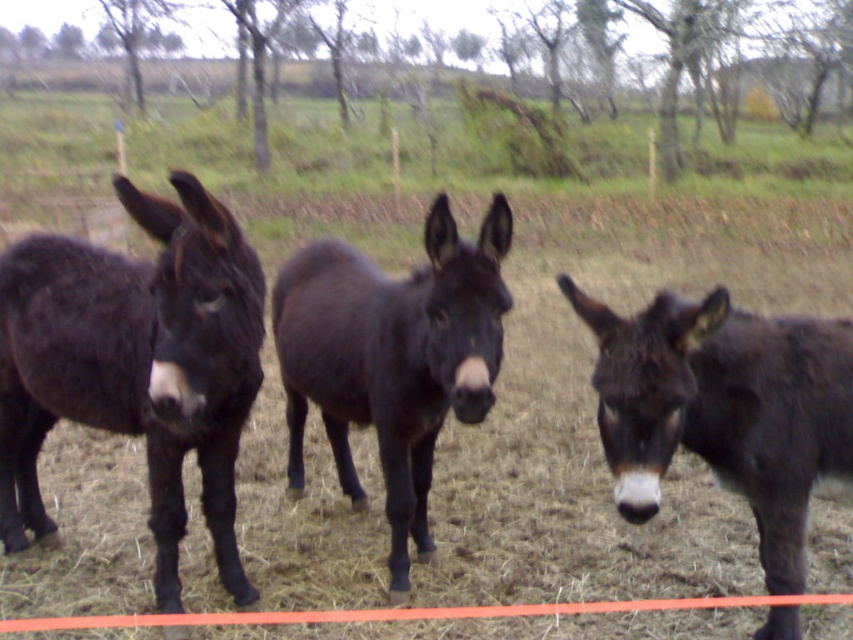
Can you confirm if shiny black mule at left is positioned to the left of dark brown fur mule at center?

Correct, you'll find shiny black mule at left to the left of dark brown fur mule at center.

Between shiny black mule at left and dark brown fur mule at center, which one is positioned lower?

Positioned lower is dark brown fur mule at center.

In order to click on shiny black mule at left in this screenshot , I will do `click(135, 364)`.

Identify the location of shiny black mule at left. The image size is (853, 640). (135, 364).

The height and width of the screenshot is (640, 853). Describe the element at coordinates (726, 410) in the screenshot. I see `dark brown fur mule at center` at that location.

Can you confirm if dark brown fur mule at center is positioned to the left of shiny dark brown mule at center?

No, dark brown fur mule at center is not to the left of shiny dark brown mule at center.

Is point (717, 356) farther from viewer compared to point (300, 458)?

No, (717, 356) is in front of (300, 458).

You are a GUI agent. You are given a task and a screenshot of the screen. Output one action in this format:
    pyautogui.click(x=<x>, y=<y>)
    Task: Click on the dark brown fur mule at center
    Image resolution: width=853 pixels, height=640 pixels.
    Given the screenshot: What is the action you would take?
    pyautogui.click(x=726, y=410)

Which is above, shiny black mule at left or shiny dark brown mule at center?

shiny black mule at left is above.

Is shiny black mule at left below shiny dark brown mule at center?

Actually, shiny black mule at left is above shiny dark brown mule at center.

You are a GUI agent. You are given a task and a screenshot of the screen. Output one action in this format:
    pyautogui.click(x=<x>, y=<y>)
    Task: Click on the shiny black mule at left
    This screenshot has width=853, height=640.
    Given the screenshot: What is the action you would take?
    pyautogui.click(x=135, y=364)